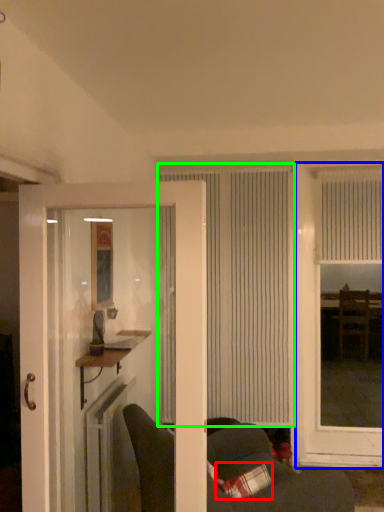
Question: Considering the real-world distances, which object is closest to pillow (highlighted by a red box)? window (highlighted by a blue box) or window (highlighted by a green box).

Choices:
 (A) window
 (B) window

Answer: (B)